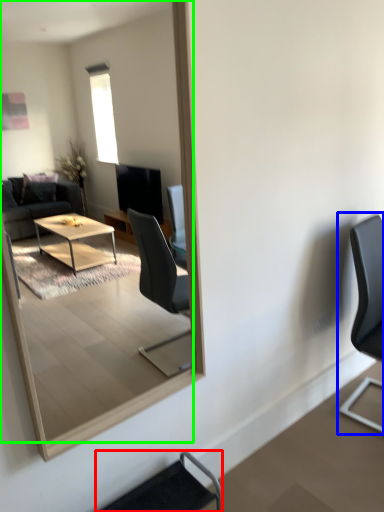
Question: Which object is positioned closest to chair (highlighted by a red box)? Select from chair (highlighted by a blue box) and mirror (highlighted by a green box).

Choices:
 (A) chair
 (B) mirror

Answer: (A)